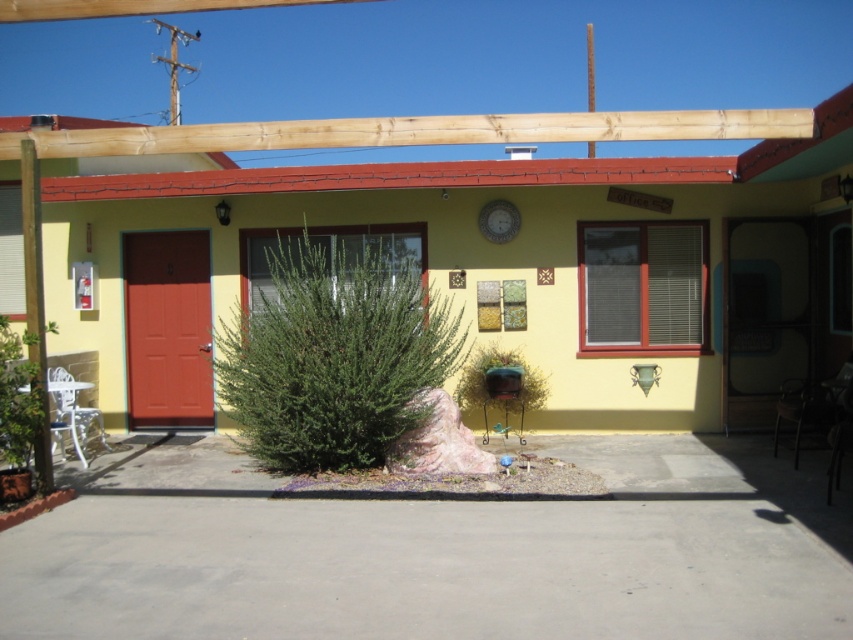
Does point (358, 412) come behind point (509, 365)?

That is False.

Is green leafy bush at center shorter than green matte bird feeder at lower center?

No, green leafy bush at center is not shorter than green matte bird feeder at lower center.

Who is more forward, [260,387] or [524,403]?

Point [260,387] is in front.

Locate an element on the screen. green leafy bush at center is located at coordinates (335, 353).

Is wooden pergola at upper center shorter than green leafy plant at lower left?

No, wooden pergola at upper center is not shorter than green leafy plant at lower left.

Who is positioned more to the right, wooden pergola at upper center or green leafy plant at lower left?

Positioned to the right is wooden pergola at upper center.

Where is `wooden pergola at upper center`? Image resolution: width=853 pixels, height=640 pixels. wooden pergola at upper center is located at coordinates (485, 268).

You are a GUI agent. You are given a task and a screenshot of the screen. Output one action in this format:
    pyautogui.click(x=<x>, y=<y>)
    Task: Click on the wooden pergola at upper center
    The width and height of the screenshot is (853, 640).
    Given the screenshot: What is the action you would take?
    pyautogui.click(x=485, y=268)

Between point (155, 317) and point (444, 330), which one is positioned in front?

Point (444, 330) is more forward.

Which is more to the left, wooden pergola at upper center or green leafy bush at center?

green leafy bush at center

Which is in front, point (117, 276) or point (305, 426)?

Point (305, 426)

In order to click on wooden pergola at upper center in this screenshot , I will do `click(485, 268)`.